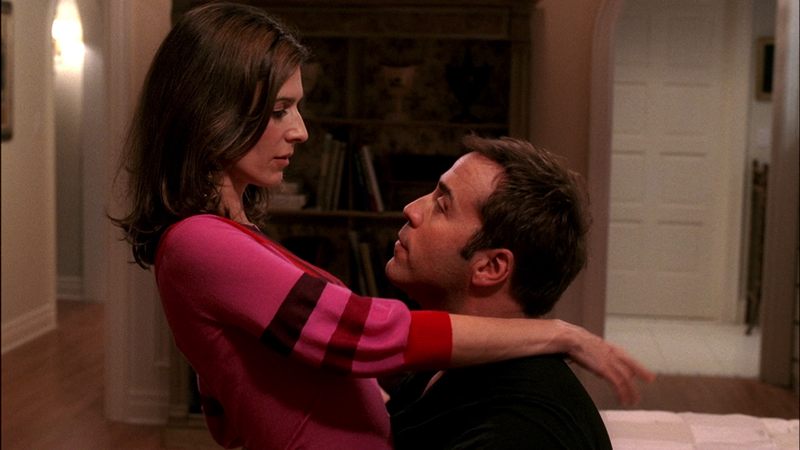
Find the location of a particular element. The width and height of the screenshot is (800, 450). lights is located at coordinates (64, 31).